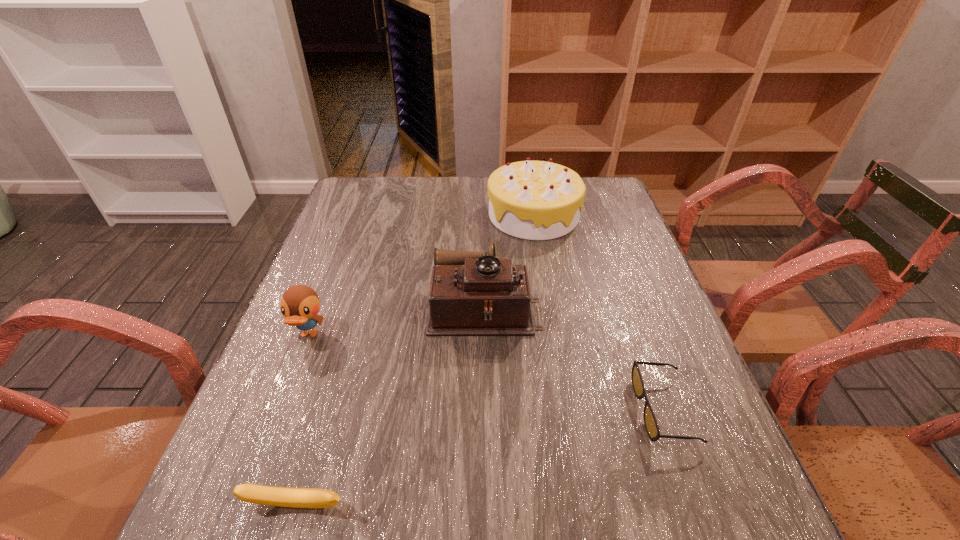
This screenshot has width=960, height=540. Identify the location of birthday cake. (535, 200).

Find the location of a particular element. phonograph_record is located at coordinates (471, 293).

You are a GUI agent. You are given a task and a screenshot of the screen. Output one action in this format:
    pyautogui.click(x=<x>, y=<y>)
    Task: Click on the duck
    
    Given the screenshot: What is the action you would take?
    pyautogui.click(x=300, y=304)

Find the location of a particular element. The image size is (960, 540). banana is located at coordinates (252, 493).

At what (x,y) coordinates should I click in order to perform the action: click on the shortest object. Please return your answer as a coordinate pair (x, y). Looking at the image, I should click on (650, 422).

In order to click on sunglasses in this screenshot , I will do `click(650, 422)`.

The width and height of the screenshot is (960, 540). Identify the location of free region located 0.300m on the left of the birthday cake. (389, 215).

Where is `vacant space located 0.120m on the horn of the phonograph_record`? vacant space located 0.120m on the horn of the phonograph_record is located at coordinates (378, 306).

You are a GUI agent. You are given a task and a screenshot of the screen. Output one action in this format:
    pyautogui.click(x=<x>, y=<y>)
    Task: Click on the free space located on the horn of the phonograph_record
    This screenshot has width=960, height=540.
    Given the screenshot: What is the action you would take?
    pyautogui.click(x=362, y=306)

This screenshot has height=540, width=960. Find the location of `vacant space situated on the horn of the phonograph_record`. vacant space situated on the horn of the phonograph_record is located at coordinates (353, 306).